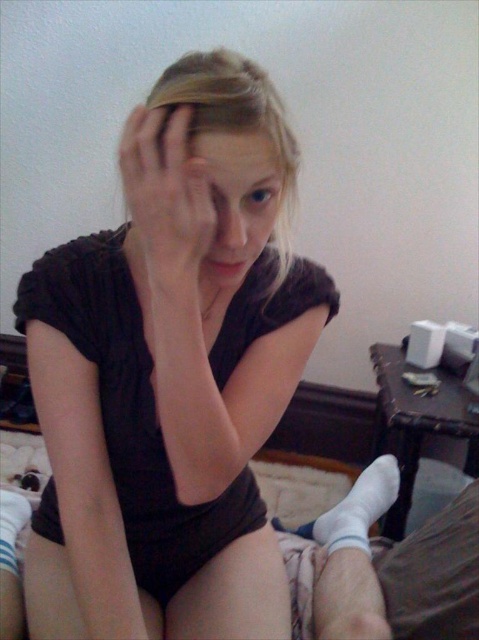
Identify the location of blonde hair at center. click(x=234, y=118).

Is point (212, 104) closer to viewer compared to point (207, 147)?

No, (212, 104) is behind (207, 147).

Where is `blonde hair at center`? The height and width of the screenshot is (640, 479). blonde hair at center is located at coordinates (234, 118).

Where is `blonde hair at center`? The width and height of the screenshot is (479, 640). blonde hair at center is located at coordinates (234, 118).

Is matte black shirt at center behind smooth skin at center?

No.

Is matte black shirt at center to the right of smooth skin at center from the viewer's perspective?

Incorrect, matte black shirt at center is not on the right side of smooth skin at center.

Does point (69, 280) come in front of point (275, 166)?

No, (69, 280) is behind (275, 166).

This screenshot has height=640, width=479. I want to click on matte black shirt at center, so (x=170, y=378).

Can you confirm if matte black shirt at center is thinner than matte skin face at center?

In fact, matte black shirt at center might be wider than matte skin face at center.

Is matte black shirt at center positioned in front of matte skin face at center?

No.

Does point (250, 540) come closer to viewer compared to point (251, 212)?

No.

At what (x,y) coordinates should I click in order to perform the action: click on matte black shirt at center. Please return your answer as a coordinate pair (x, y). Looking at the image, I should click on (170, 378).